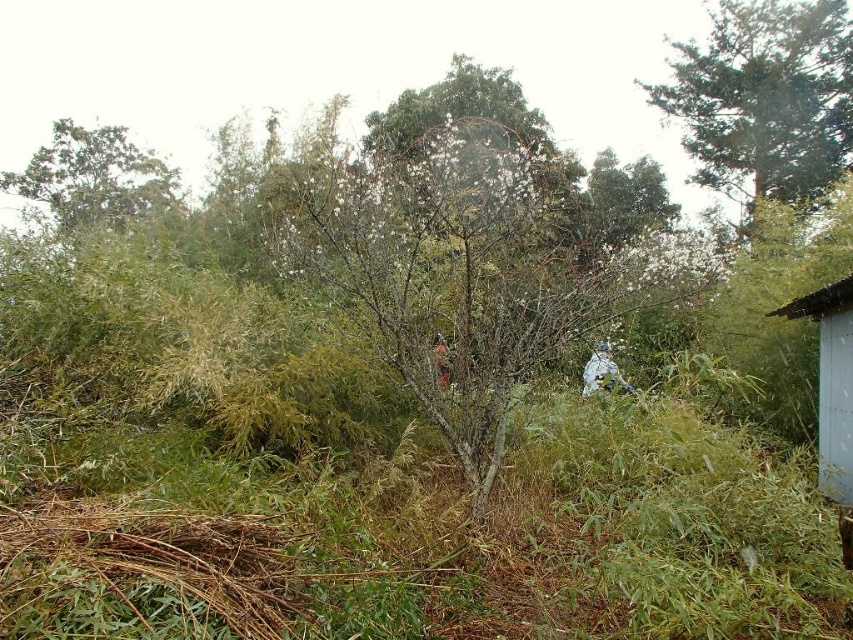
From the picture: How much distance is there between green matte tree at center and green leafy tree at upper left?

green matte tree at center is 7.95 meters away from green leafy tree at upper left.

Is green matte tree at center behind green leafy tree at upper left?

No, it is in front of green leafy tree at upper left.

The height and width of the screenshot is (640, 853). What are the coordinates of `green matte tree at center` in the screenshot? It's located at click(x=468, y=268).

Is white fabric at center taller than white matte person at center?

Correct, white fabric at center is much taller as white matte person at center.

Who is positioned more to the right, white fabric at center or white matte person at center?

From the viewer's perspective, white fabric at center appears more on the right side.

At what (x,y) coordinates should I click in order to perform the action: click on white fabric at center. Please return your answer as a coordinate pair (x, y). Looking at the image, I should click on (601, 372).

Where is `white fabric at center`? The height and width of the screenshot is (640, 853). white fabric at center is located at coordinates (601, 372).

Can you confirm if white wood hut at right is bigger than white fabric at center?

Indeed, white wood hut at right has a larger size compared to white fabric at center.

In the scene shown: How far apart are white wood hut at right and white fabric at center?

white wood hut at right and white fabric at center are 2.36 meters apart.

The width and height of the screenshot is (853, 640). I want to click on white wood hut at right, so click(x=831, y=381).